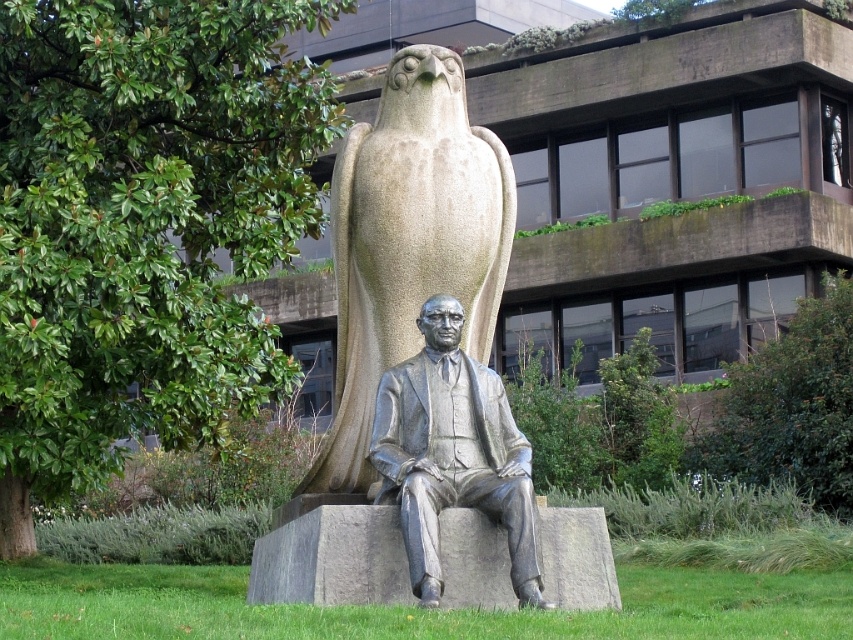
You are a park visitor who wants to take a photo of both the granite eagle at center and the polished bronze statue at center. Which object should you position closer to the camera to ensure both are fully visible in the frame?

The granite eagle at center is taller than the polished bronze statue at center, so you should position the granite eagle at center closer to the camera to ensure both are fully visible in the frame.

You are a visitor standing in front of the sculpture. You want to take a photo of the polished bronze statue at center without the granite eagle at center appearing in the frame. Is this possible given their positions?

The granite eagle at center is further to the viewer than the polished bronze statue at center. Therefore, since the eagle is closer to you, it would block the view of the bronze statue behind it. To take a photo of the polished bronze statue at center without the granite eagle at center in the frame, you would need to move to a position where the eagle is no longer between you and the statue.

You are a photographer standing at the base of the sculpture. You notice two points marked on the sculpture. One is at point coordinates point (384,368) and the other at point coordinates point (454,396). Which point is closer to you?

Point (384,368) is further to the camera than point (454,396). Therefore, the point at (454,396) is closer to you.